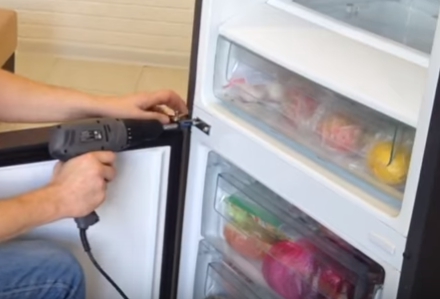
Find the location of a particular element. inside of fridge door is located at coordinates point(138,200).